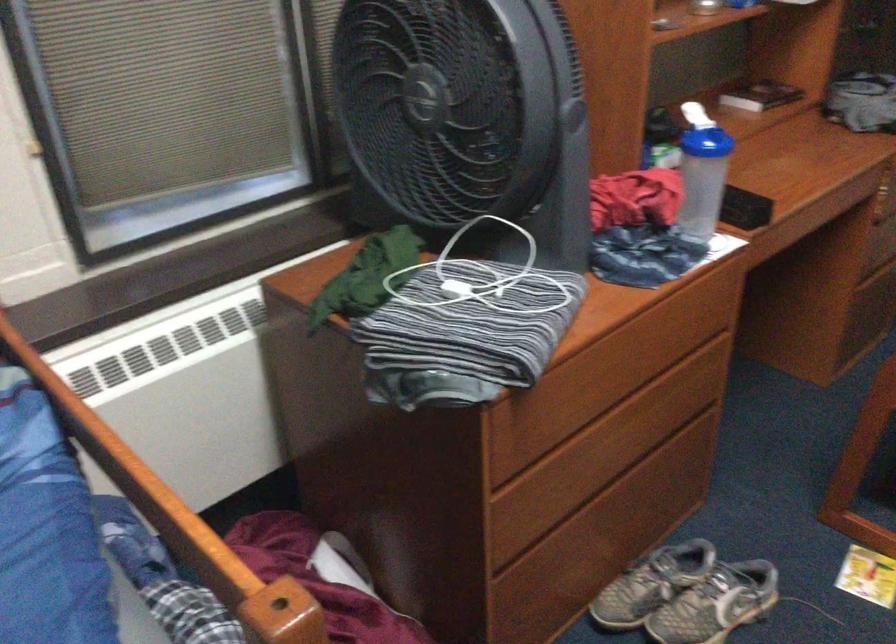
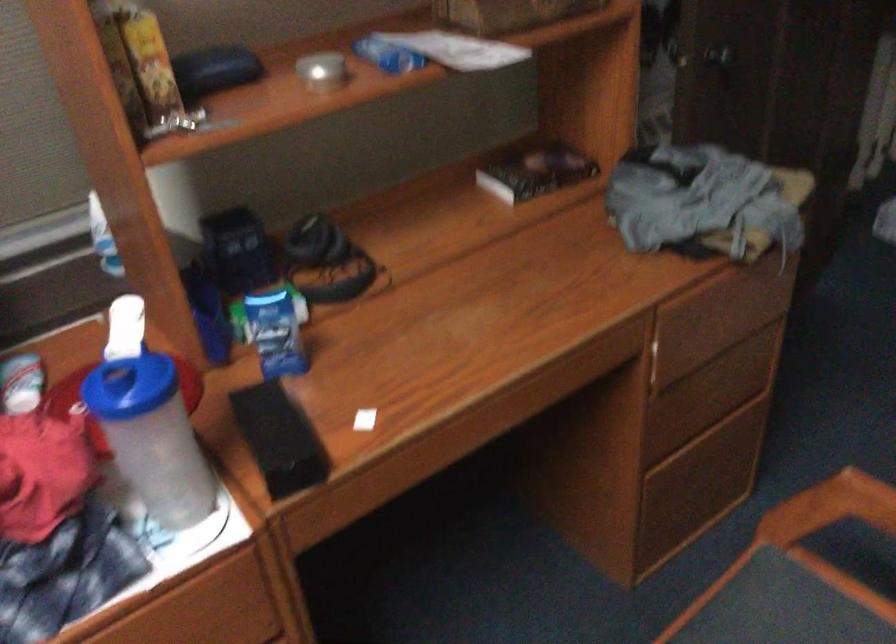
Locate, in the second image, the point that corresponds to point (767, 87) in the first image.

(536, 172)